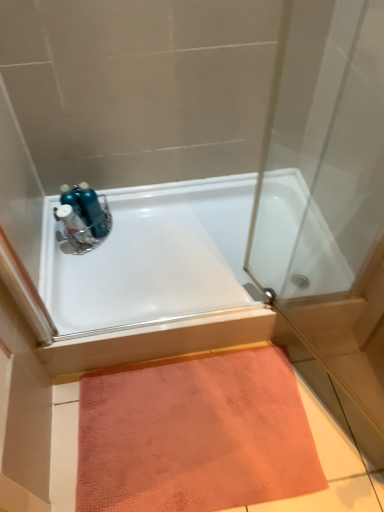
Question: Does orange textured mat at lower center lie behind white glossy bathtub at upper center?

Choices:
 (A) yes
 (B) no

Answer: (B)

Question: Can you confirm if orange textured mat at lower center is thinner than white glossy bathtub at upper center?

Choices:
 (A) no
 (B) yes

Answer: (B)

Question: Is white glossy bathtub at upper center at the back of orange textured mat at lower center?

Choices:
 (A) yes
 (B) no

Answer: (B)

Question: Would you say orange textured mat at lower center is a long distance from white glossy bathtub at upper center?

Choices:
 (A) no
 (B) yes

Answer: (A)

Question: From the image's perspective, would you say orange textured mat at lower center is positioned over white glossy bathtub at upper center?

Choices:
 (A) no
 (B) yes

Answer: (A)

Question: Is orange textured mat at lower center wider than white glossy bathtub at upper center?

Choices:
 (A) yes
 (B) no

Answer: (B)

Question: Is orange textured mat at lower center smaller than blue metallic bottles at upper left?

Choices:
 (A) no
 (B) yes

Answer: (A)

Question: From the image's perspective, is orange textured mat at lower center located beneath blue metallic bottles at upper left?

Choices:
 (A) no
 (B) yes

Answer: (B)

Question: Does orange textured mat at lower center appear on the right side of blue metallic bottles at upper left?

Choices:
 (A) no
 (B) yes

Answer: (B)

Question: Is blue metallic bottles at upper left a part of orange textured mat at lower center?

Choices:
 (A) no
 (B) yes

Answer: (A)

Question: Can you confirm if orange textured mat at lower center is positioned to the left of blue metallic bottles at upper left?

Choices:
 (A) yes
 (B) no

Answer: (B)

Question: Does orange textured mat at lower center have a larger size compared to blue metallic bottles at upper left?

Choices:
 (A) no
 (B) yes

Answer: (B)

Question: From a real-world perspective, does blue metallic bottles at upper left sit lower than metallic blue sink at upper left?

Choices:
 (A) yes
 (B) no

Answer: (A)